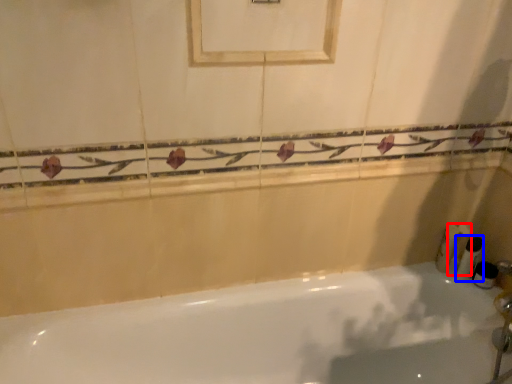
Question: Which of the following is the farthest to the observer, toiletry (highlighted by a red box) or toiletry (highlighted by a blue box)?

Choices:
 (A) toiletry
 (B) toiletry

Answer: (A)